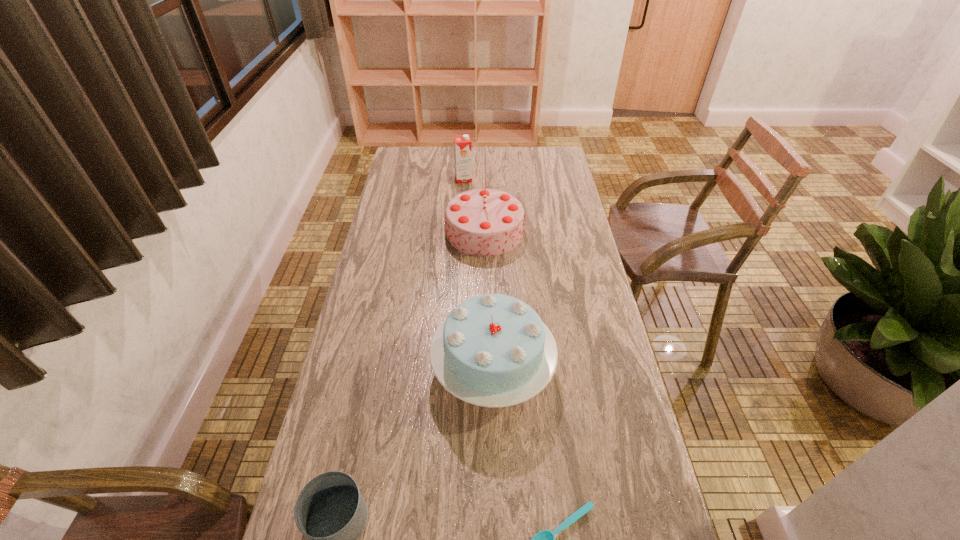
At what (x,y) coordinates should I click in order to perform the action: click on unoccupied area between the nearer birthday cake and the farthest object. Please return your answer as a coordinate pair (x, y). The height and width of the screenshot is (540, 960). Looking at the image, I should click on (478, 274).

Locate which object is the closest to the farthest object. Please provide its 2D coordinates. Your answer should be formatted as a tuple, i.e. [(x, y)], where the tuple contains the x and y coordinates of a point satisfying the conditions above.

[(483, 222)]

Image resolution: width=960 pixels, height=540 pixels. What are the coordinates of `object that is the third nearest to the spoon` in the screenshot? It's located at tap(483, 222).